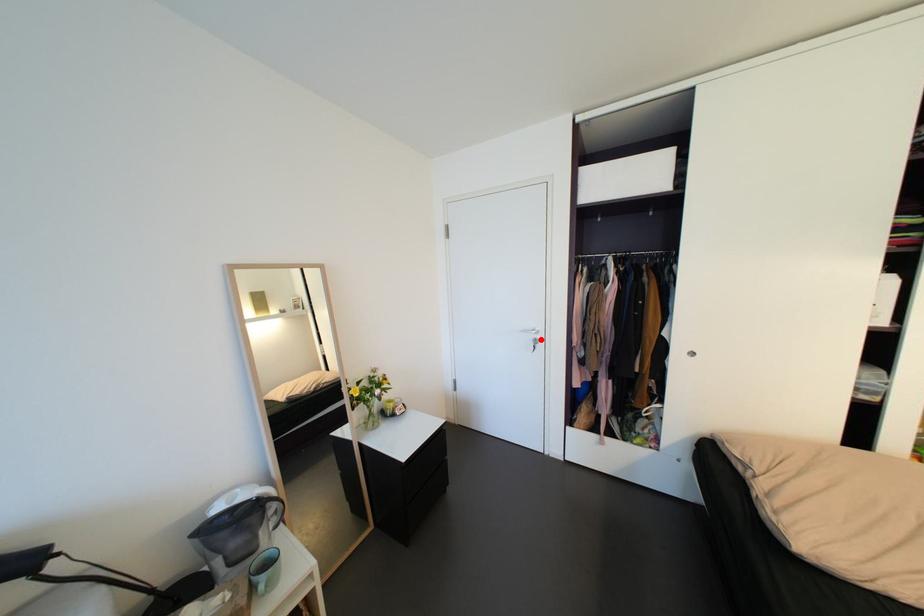
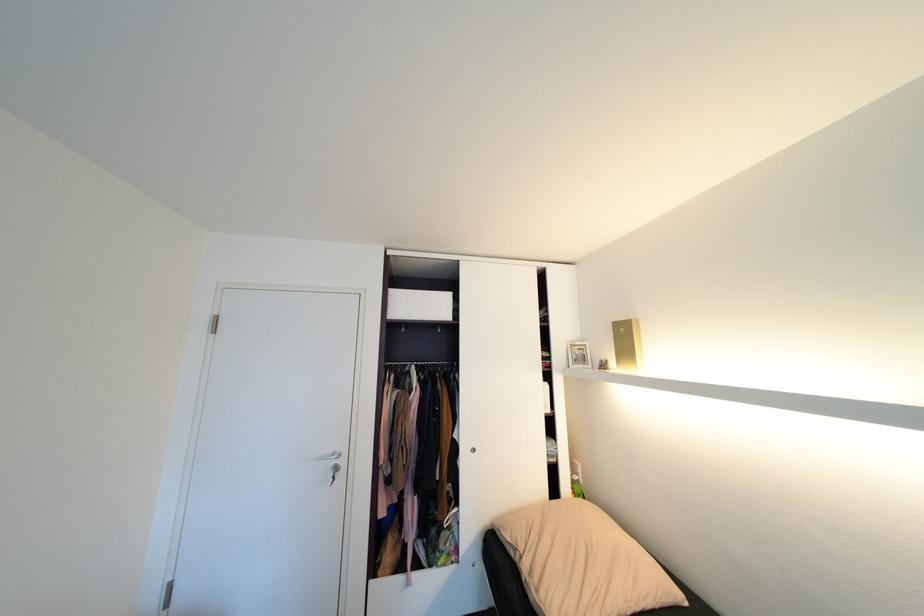
The point at the highlighted location is marked in the first image. Where is the corresponding point in the second image?

(341, 467)